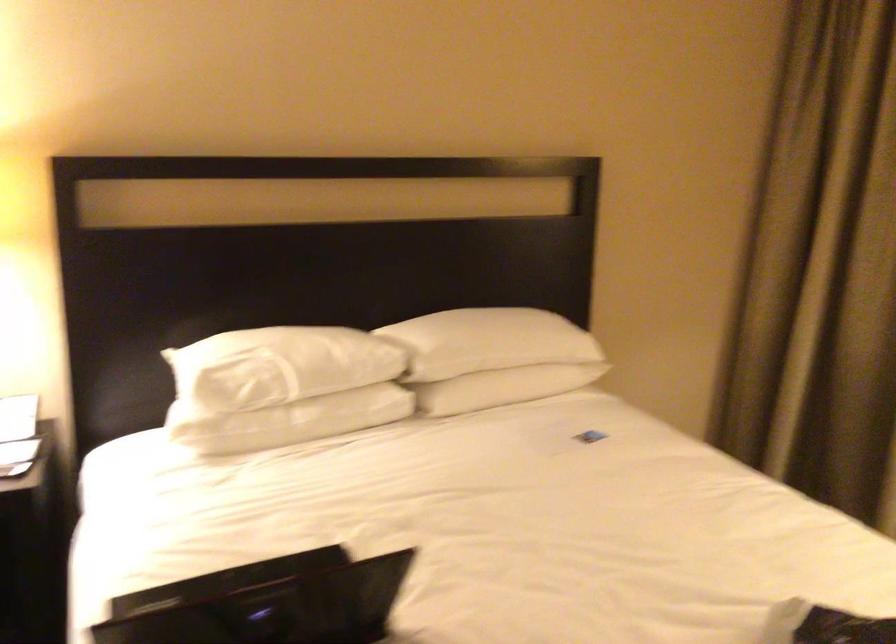
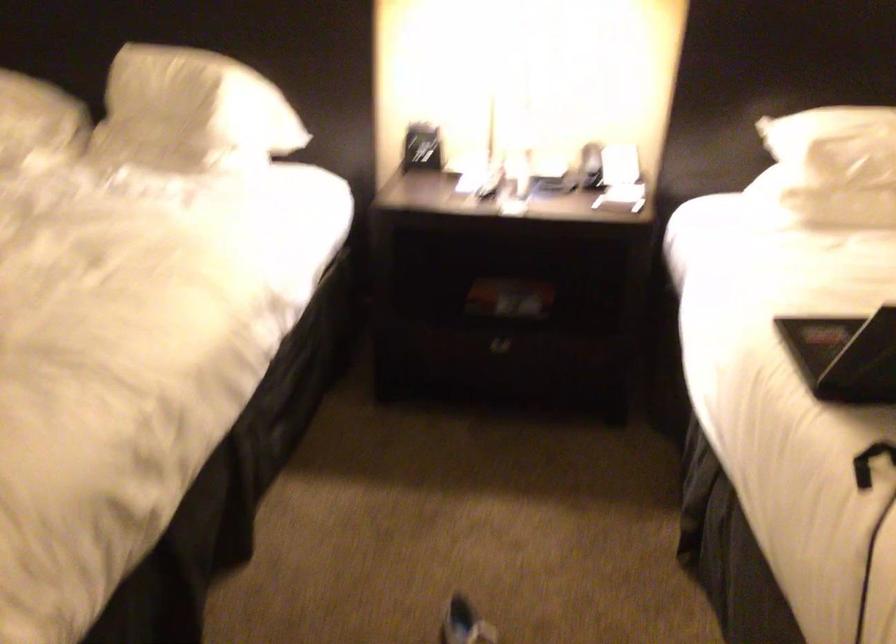
Find the pixel in the second image that matches (x=217, y=399) in the first image.

(831, 167)